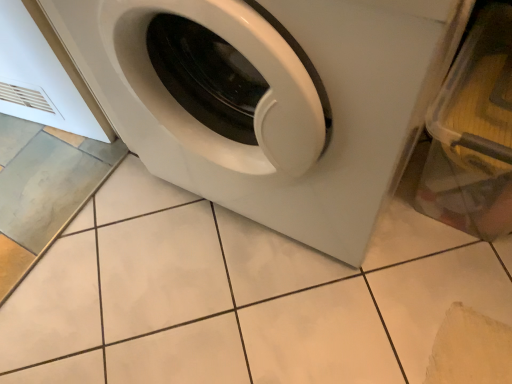
Describe the element at coordinates (270, 99) in the screenshot. I see `white glossy washing machine at center` at that location.

What is the approximate width of white glossy washing machine at center?

white glossy washing machine at center is 20.68 inches wide.

The width and height of the screenshot is (512, 384). Find the location of `white glossy washing machine at center`. white glossy washing machine at center is located at coordinates (270, 99).

Find the location of `white glossy washing machine at center`. white glossy washing machine at center is located at coordinates (270, 99).